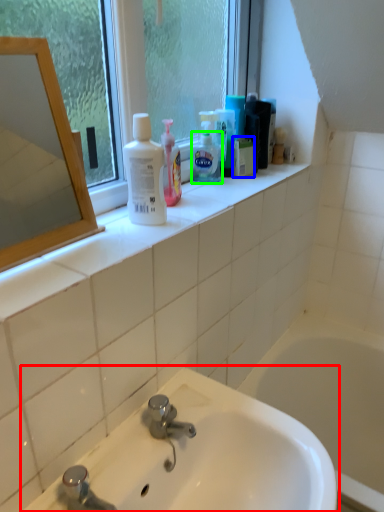
Question: Based on their relative distances, which object is nearer to sink (highlighted by a red box)? Choose from mouthwash (highlighted by a blue box) and shaving cream (highlighted by a green box).

Choices:
 (A) mouthwash
 (B) shaving cream

Answer: (B)